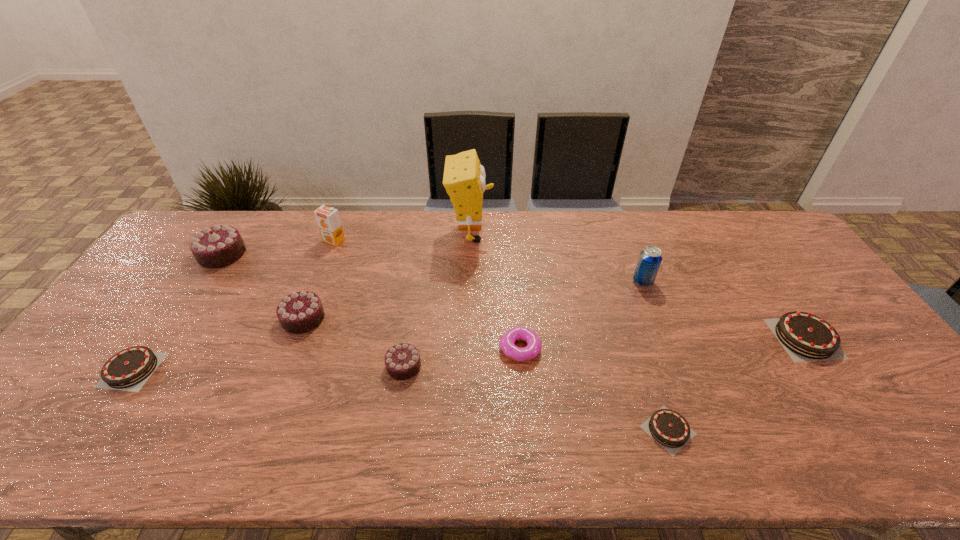
Locate an element on the screen. vacant area situated on the right of the orange orange juice is located at coordinates (369, 241).

Where is `vacant space located on the front of the beer can`? This screenshot has width=960, height=540. vacant space located on the front of the beer can is located at coordinates (683, 384).

At what (x,y) coordinates should I click in order to perform the action: click on free region located on the front of the seventh shortest object. Please return your answer as a coordinate pair (x, y). This screenshot has width=960, height=540. Looking at the image, I should click on (181, 316).

This screenshot has width=960, height=540. Identify the location of vacant space situated on the back of the sixth shortest object. (322, 271).

Image resolution: width=960 pixels, height=540 pixels. I want to click on free region located on the left of the third chocolate cake from right to left, so click(258, 366).

Find the location of `free space located on the front of the rightmost chocolate cake`. free space located on the front of the rightmost chocolate cake is located at coordinates (836, 386).

Identify the location of vacant space located on the front of the second biggest brown chocolate cake. (73, 456).

Where is `free point located 0.090m on the left of the seventh object from left to right`? This screenshot has width=960, height=540. free point located 0.090m on the left of the seventh object from left to right is located at coordinates (466, 349).

Identify the location of vacant space located on the right of the shortest chocolate cake. Image resolution: width=960 pixels, height=540 pixels. (726, 430).

Find the location of a particular element. The width and height of the screenshot is (960, 540). sponge that is positioned at the far edge is located at coordinates (464, 179).